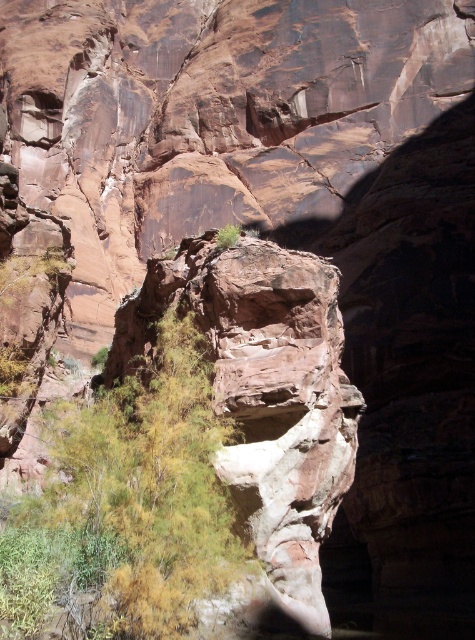
Between rustic stone cliff at center and green leafy shrub at center, which one has more height?

Standing taller between the two is rustic stone cliff at center.

How distant is rustic stone cliff at center from green leafy shrub at center?

rustic stone cliff at center is 5.59 meters from green leafy shrub at center.

Locate an element on the screen. rustic stone cliff at center is located at coordinates (263, 406).

In order to click on rustic stone cliff at center in this screenshot , I will do `click(263, 406)`.